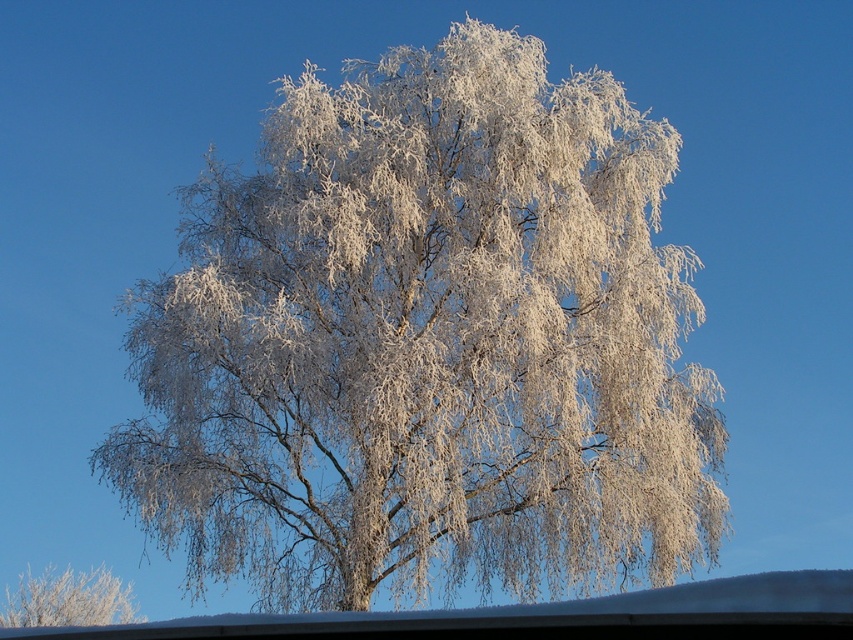
Who is more distant from viewer, (404, 305) or (44, 616)?

The point (44, 616) is more distant.

Where is `white frosty birch tree at center`? white frosty birch tree at center is located at coordinates (428, 346).

Between point (384, 570) and point (20, 577), which one is positioned in front?

Point (384, 570) is in front.

Find the location of a particular element. This screenshot has width=853, height=640. white frosty birch tree at center is located at coordinates (428, 346).